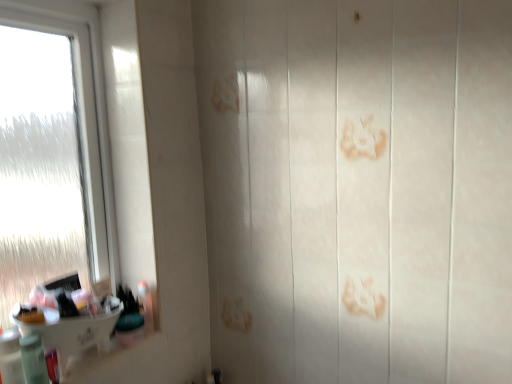
Question: Is transparent frosted glass at left positioned with its back to green plastic container at lower left, the 1th toiletry in the right-to-left sequence?

Choices:
 (A) yes
 (B) no

Answer: (B)

Question: Is transparent frosted glass at left located outside green plastic container at lower left, the 1th toiletry in the right-to-left sequence?

Choices:
 (A) yes
 (B) no

Answer: (A)

Question: Is green plastic container at lower left, the 4th toiletry from the front, completely or partially inside transparent frosted glass at left?

Choices:
 (A) yes
 (B) no

Answer: (B)

Question: Considering the relative sizes of transparent frosted glass at left and green plastic container at lower left, the 4th toiletry from the front, in the image provided, is transparent frosted glass at left thinner than green plastic container at lower left, the 4th toiletry from the front,?

Choices:
 (A) no
 (B) yes

Answer: (A)

Question: From the image's perspective, is transparent frosted glass at left below green plastic container at lower left, which is the fourth toiletry from left to right?

Choices:
 (A) yes
 (B) no

Answer: (B)

Question: From their relative heights in the image, would you say transparent frosted glass at left is taller or shorter than translucent plastic bottle at lower left, which appears as the 2th toiletry when viewed from the front?

Choices:
 (A) short
 (B) tall

Answer: (B)

Question: From the image's perspective, relative to translucent plastic bottle at lower left, which is the third toiletry in right-to-left order, is transparent frosted glass at left above or below?

Choices:
 (A) below
 (B) above

Answer: (B)

Question: Looking at their shapes, would you say transparent frosted glass at left is wider or thinner than translucent plastic bottle at lower left, which appears as the 2th toiletry when viewed from the front?

Choices:
 (A) thin
 (B) wide

Answer: (B)

Question: Is transparent frosted glass at left situated inside translucent plastic bottle at lower left, which is the second toiletry in left-to-right order, or outside?

Choices:
 (A) outside
 (B) inside

Answer: (A)

Question: From the image's perspective, relative to translucent plastic bottle at lower left, which is the second toiletry in left-to-right order, is translucent plastic tube at lower left, marked as the 2th toiletry in a back-to-front arrangement, above or below?

Choices:
 (A) below
 (B) above

Answer: (A)

Question: Is translucent plastic tube at lower left, the 3th toiletry when ordered from left to right, taller or shorter than translucent plastic bottle at lower left, which is the 3th toiletry in back-to-front order?

Choices:
 (A) short
 (B) tall

Answer: (A)

Question: Is translucent plastic tube at lower left, marked as the 2th toiletry in a back-to-front arrangement, spatially inside translucent plastic bottle at lower left, which is the second toiletry in left-to-right order, or outside of it?

Choices:
 (A) inside
 (B) outside

Answer: (B)

Question: In the image, is translucent plastic tube at lower left, the 3th toiletry when ordered from left to right, positioned in front of or behind translucent plastic bottle at lower left, which is the second toiletry in left-to-right order?

Choices:
 (A) front
 (B) behind

Answer: (B)

Question: In terms of height, does white glossy sink at lower left look taller or shorter compared to green plastic container at lower left, the 1th toiletry in the right-to-left sequence?

Choices:
 (A) short
 (B) tall

Answer: (B)

Question: In the image, is white glossy sink at lower left positioned in front of or behind green plastic container at lower left, the 4th toiletry from the front?

Choices:
 (A) behind
 (B) front

Answer: (B)